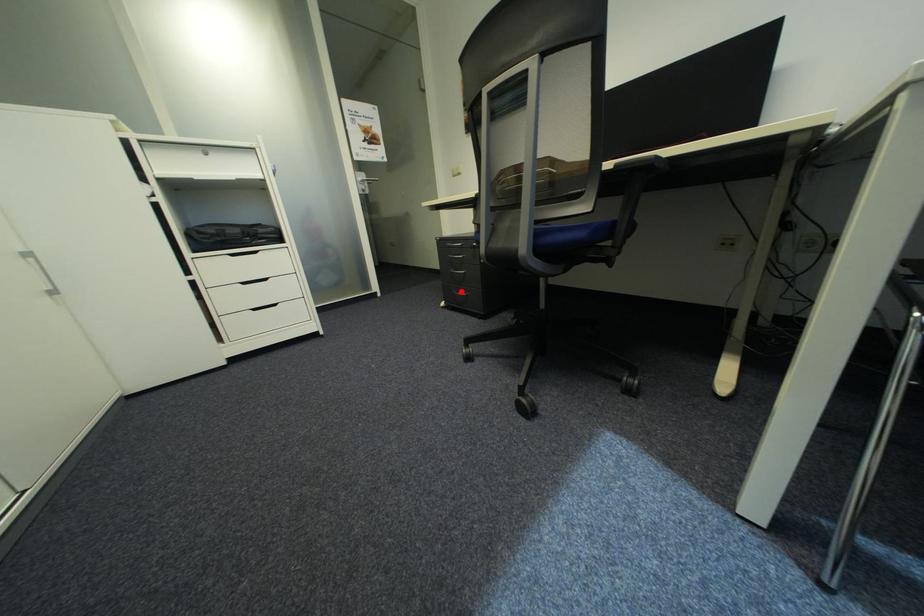
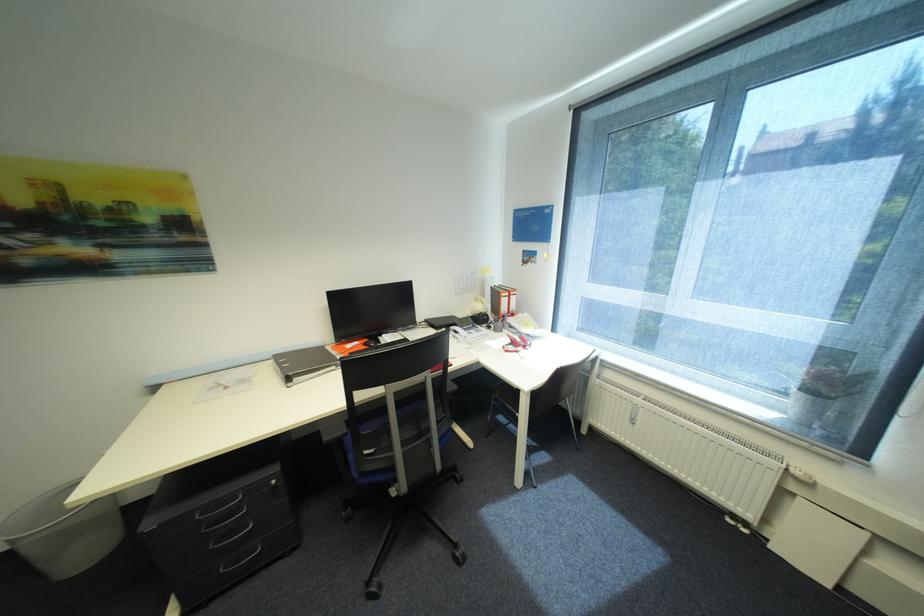
Question: I am providing you with two images of the same scene from different viewpoints. In image1, a red point is highlighted. Considering the same 3D point in image2, which of the following is correct?

Choices:
 (A) It is closer
 (B) It is farther

Answer: (A)